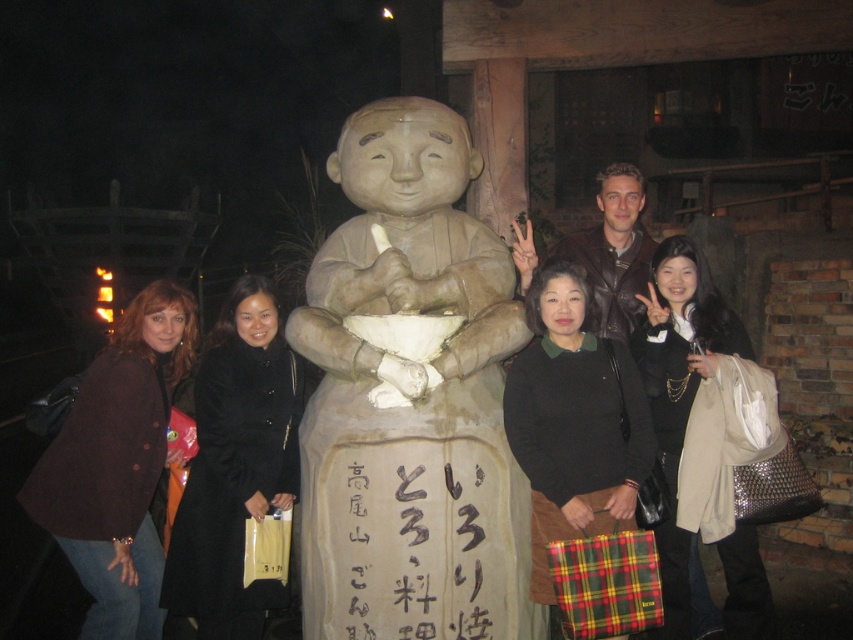
You are standing in front of the statue and want to take a photo of the group. If you are 4 meters away from the point at coordinates point [112,492], will you be able to capture the entire group in your camera frame?

The distance of point [112,492] from viewer is 4.11 meters. Since you are 4 meters away, you are closer than the point, so you can capture the entire group in your camera frame.

You are standing in front of the statue and want to take a photo of the black calligraphy sign at center and the black wool coat at left. Which object is nearer to you?

The black calligraphy sign at center is closer to the viewer than the black wool coat at left.

You are a photographer trying to capture a clear shot of both the black calligraphy sign at center and the black wool coat at left. Since you want to focus on both objects equally, which one should you adjust your camera focus to prioritize based on their sizes?

The black calligraphy sign at center is smaller than the black wool coat at left, so you should prioritize focusing on the black wool coat at left first since it is larger and might require more detailed focus to capture clearly.